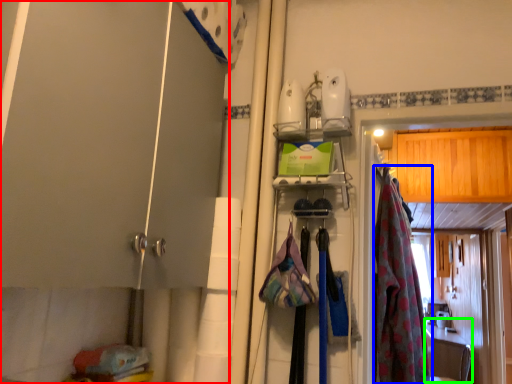
Question: Which object is the closest to the door (highlighted by a red box)? Choose among these: clothing (highlighted by a blue box) or counter top (highlighted by a green box).

Choices:
 (A) clothing
 (B) counter top

Answer: (A)